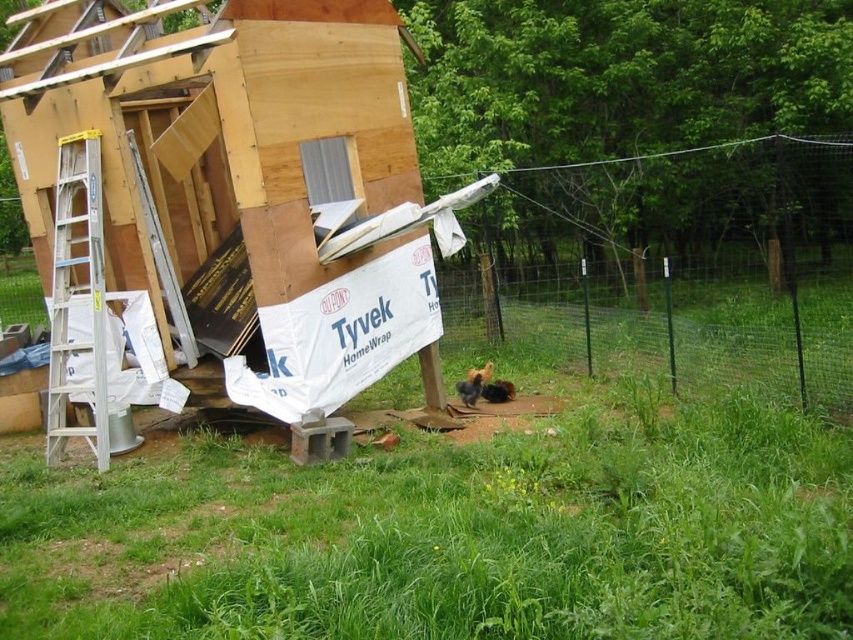
Question: Can you confirm if wooden hut at left is smaller than green wire mesh at center?

Choices:
 (A) yes
 (B) no

Answer: (A)

Question: Considering the real-world distances, which object is farthest from the silver/aluminum ladder at left?

Choices:
 (A) wooden hut at left
 (B) green wire mesh at center

Answer: (B)

Question: Which of the following is the closest to the observer?

Choices:
 (A) (335, 272)
 (B) (659, 156)

Answer: (A)

Question: Does green grass at lower center appear under green wire mesh at center?

Choices:
 (A) yes
 (B) no

Answer: (A)

Question: Which of these objects is positioned closest to the silver/aluminum ladder at left?

Choices:
 (A) wooden hut at left
 (B) green wire mesh at center

Answer: (A)

Question: Considering the relative positions of wooden hut at left and green wire mesh at center in the image provided, where is wooden hut at left located with respect to green wire mesh at center?

Choices:
 (A) above
 (B) below

Answer: (A)